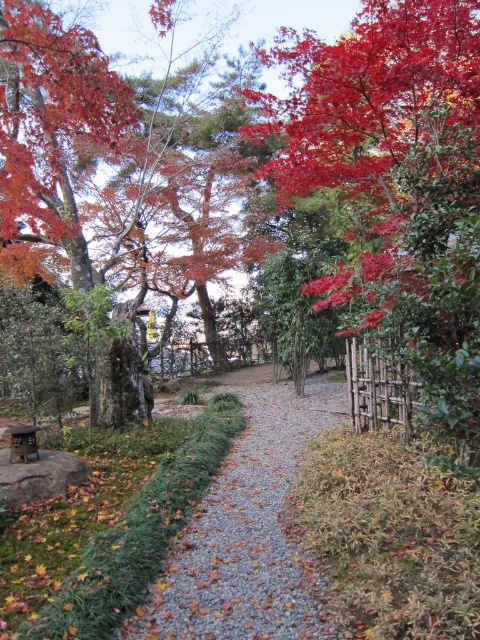
Between gray gravel path at center and brown wooden picnic table at lower left, which one has more height?

With more height is gray gravel path at center.

Between gray gravel path at center and brown wooden picnic table at lower left, which one is positioned higher?

brown wooden picnic table at lower left is higher up.

This screenshot has height=640, width=480. I want to click on gray gravel path at center, so click(x=247, y=529).

Find the location of a particular element. gray gravel path at center is located at coordinates (247, 529).